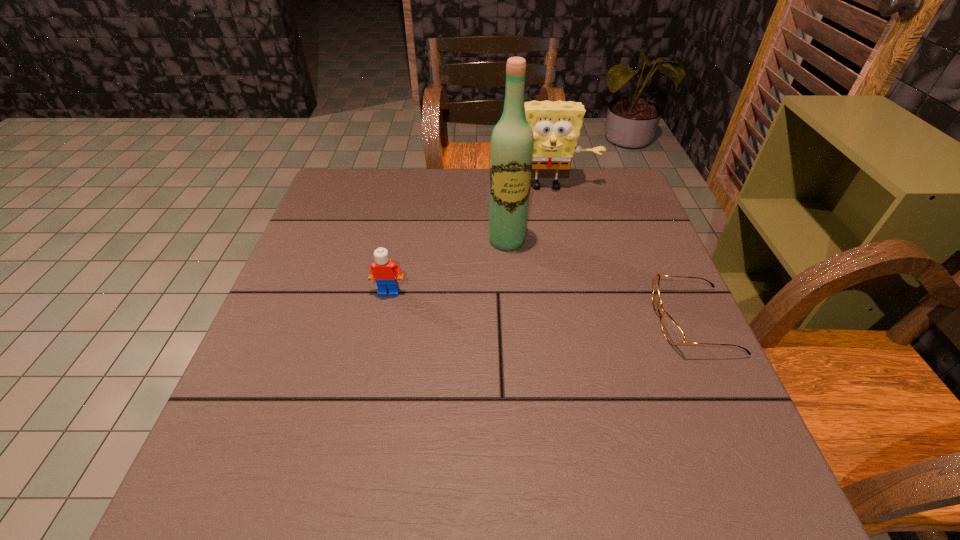
The width and height of the screenshot is (960, 540). In order to click on sponge present at the right edge in this screenshot , I will do `click(556, 126)`.

This screenshot has width=960, height=540. Find the location of `object situated at the far right corner`. object situated at the far right corner is located at coordinates (556, 126).

You are a GUI agent. You are given a task and a screenshot of the screen. Output one action in this format:
    pyautogui.click(x=<x>, y=<y>)
    Task: Click on the free point at the far edge
    The width and height of the screenshot is (960, 540).
    Given the screenshot: What is the action you would take?
    pyautogui.click(x=573, y=177)

The image size is (960, 540). In the image, there is a desktop. Find the location of `vacant space at the near edge`. vacant space at the near edge is located at coordinates (460, 400).

Find the location of `free space at the left edge`. free space at the left edge is located at coordinates (294, 325).

Image resolution: width=960 pixels, height=540 pixels. Find the location of `blank area at the right edge`. blank area at the right edge is located at coordinates (643, 239).

Where is `vacant space at the far left corner`? The image size is (960, 540). vacant space at the far left corner is located at coordinates (x=328, y=199).

In the image, there is a desktop. At what (x,y) coordinates should I click in order to perform the action: click on vacant space at the near left corner. Please return your answer as a coordinate pair (x, y). This screenshot has height=540, width=960. Looking at the image, I should click on (249, 399).

Find the location of a particular element. The width and height of the screenshot is (960, 540). vacant space at the far right corner of the desktop is located at coordinates (602, 213).

At what (x,y) coordinates should I click in order to perform the action: click on vacant space at the near right corner. Please return your answer as a coordinate pair (x, y). Looking at the image, I should click on (663, 436).